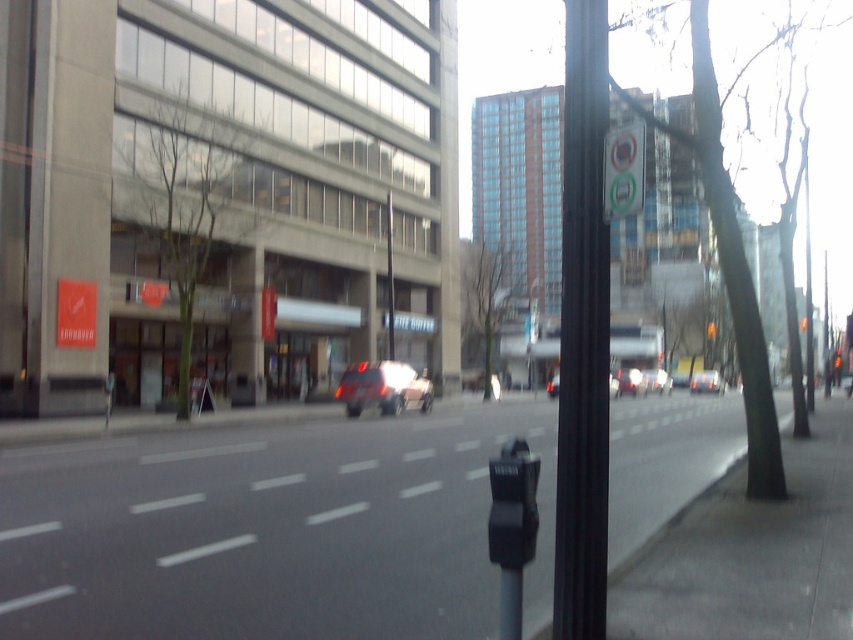
Question: Does black plastic parking meter at lower center lie in front of metallic silver car at center?

Choices:
 (A) yes
 (B) no

Answer: (A)

Question: Does metallic silver car at center come behind metallic silver suv at center?

Choices:
 (A) no
 (B) yes

Answer: (B)

Question: Which object is closer to the camera taking this photo?

Choices:
 (A) metallic silver car at center
 (B) black metal pole at center

Answer: (B)

Question: Which of the following is the farthest from the observer?

Choices:
 (A) shiny red car at center
 (B) white plastic sign at upper center
 (C) black plastic parking meter at lower center
 (D) metallic silver suv at center

Answer: (D)

Question: Which of the following is the farthest from the observer?

Choices:
 (A) gray asphalt at center
 (B) matte red suv at center
 (C) shiny red car at center

Answer: (B)

Question: In this image, where is gray asphalt at center located relative to shiny red car at center?

Choices:
 (A) below
 (B) above

Answer: (B)